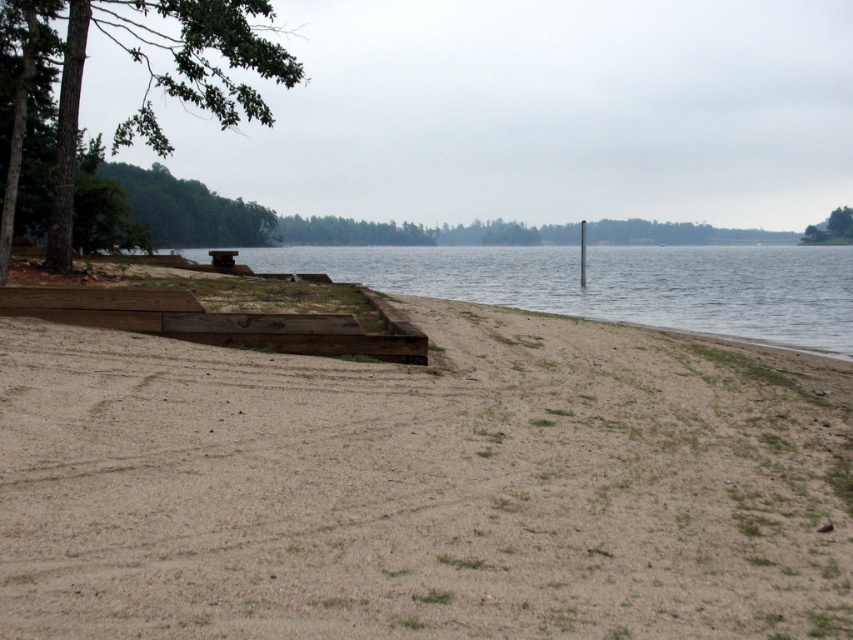
Who is higher up, green leafy tree at upper right or smooth gray pole at right?

green leafy tree at upper right is higher up.

Does green leafy tree at upper right appear under smooth gray pole at right?

No.

You are a GUI agent. You are given a task and a screenshot of the screen. Output one action in this format:
    pyautogui.click(x=<x>, y=<y>)
    Task: Click on the green leafy tree at upper right
    The image size is (853, 640).
    Given the screenshot: What is the action you would take?
    pyautogui.click(x=831, y=228)

Which of these two, brown sandy beach at lower left or clear water at center, stands shorter?

Standing shorter between the two is brown sandy beach at lower left.

Between brown sandy beach at lower left and clear water at center, which one appears on the left side from the viewer's perspective?

brown sandy beach at lower left is more to the left.

Who is more forward, (x=840, y=429) or (x=431, y=256)?

Positioned in front is point (x=840, y=429).

This screenshot has width=853, height=640. I want to click on brown sandy beach at lower left, so click(424, 484).

Measure the distance between clear water at center and camera.

57.61 feet

Which is behind, point (819, 314) or point (583, 284)?

The point (583, 284) is behind.

The image size is (853, 640). I want to click on clear water at center, so click(616, 284).